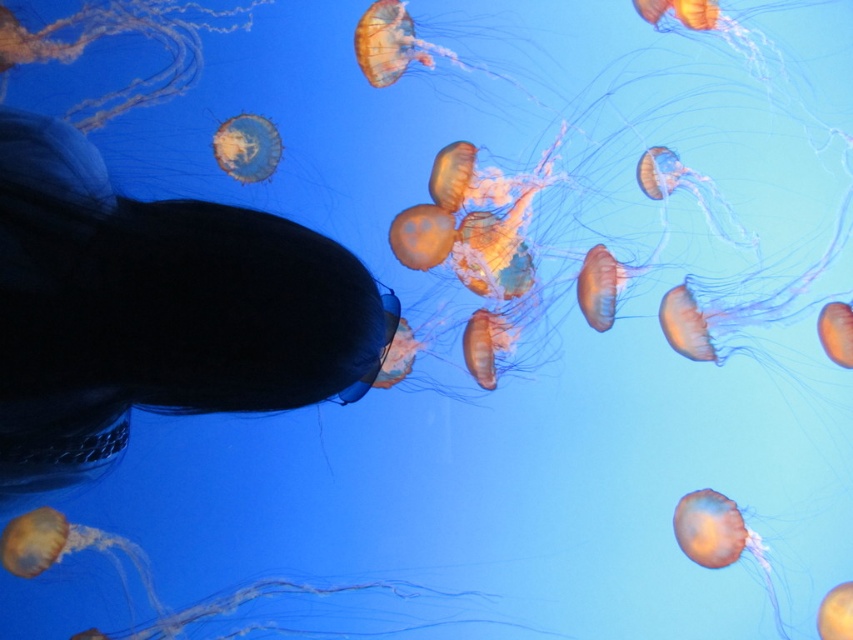
Question: Is translucent orange jellyfish at lower right above translucent orange jellyfish at upper center?

Choices:
 (A) yes
 (B) no

Answer: (B)

Question: Does translucent orange jellyfish at lower right appear on the right side of translucent orange jellyfish at upper center?

Choices:
 (A) yes
 (B) no

Answer: (A)

Question: Can you confirm if translucent orange jellyfish at lower right is thinner than translucent orange jellyfish at upper center?

Choices:
 (A) no
 (B) yes

Answer: (A)

Question: Which of the following is the closest to the observer?

Choices:
 (A) translucent orange jellyfish at lower right
 (B) translucent orange jellyfish at upper center

Answer: (A)